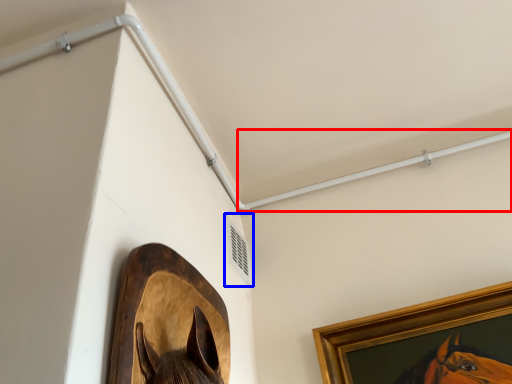
Question: Among these objects, which one is farthest to the camera, beam (highlighted by a red box) or air conditioning (highlighted by a blue box)?

Choices:
 (A) beam
 (B) air conditioning

Answer: (A)